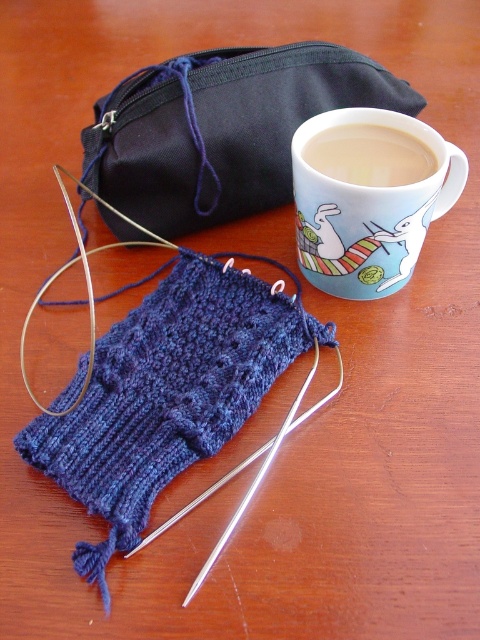
You are organizing a craft fair booth and have both the matte black pouch at upper center and the black fabric pouch at upper center. Which pouch would you choose if you want to display an item that requires more vertical space?

The matte black pouch at upper center has a greater height compared to the black fabric pouch at upper center, so it would be the better choice for displaying an item that requires more vertical space.

You are a person sitting at the wooden surface where the partially knitted item in deep blue is located. You need to place a small item exactly at the point with coordinates point [222,129]. Where should you place it?

You should place the small item on the black fabric pouch at upper center because the point [222,129] is located there.

Looking at this image, you are organizing items on a wooden desk and notice two matte ceramic mugs. According to the scene, where is the matte ceramic mug at upper right positioned relative to the matte ceramic mug at upper center?

The matte ceramic mug at upper right is to the left of the matte ceramic mug at upper center.